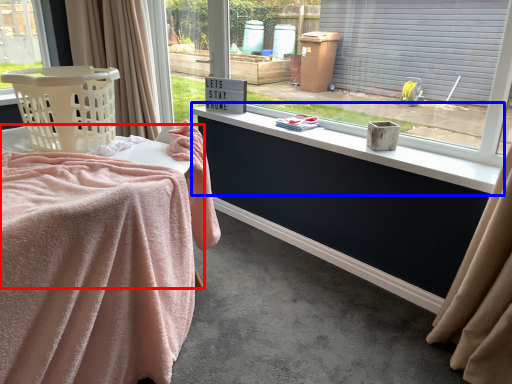
Question: Which point is closer to the camera, table (highlighted by a red box) or window sill (highlighted by a blue box)?

Choices:
 (A) table
 (B) window sill

Answer: (A)